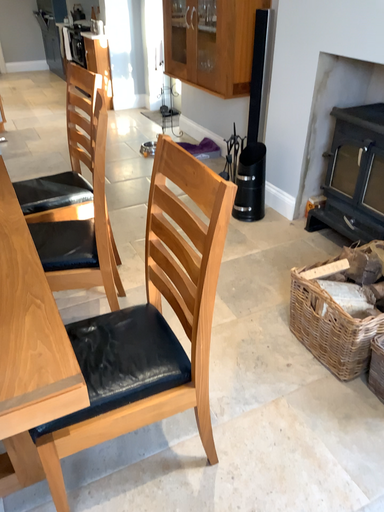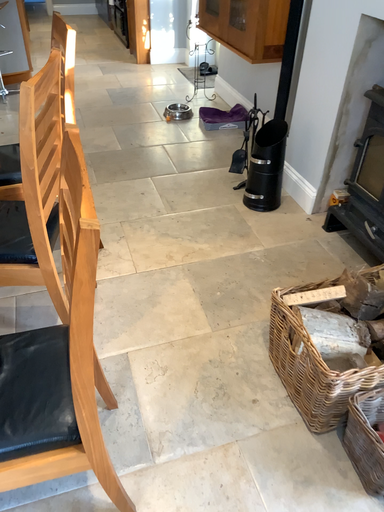
Question: How did the camera likely rotate when shooting the video?

Choices:
 (A) rotated right
 (B) rotated left

Answer: (B)